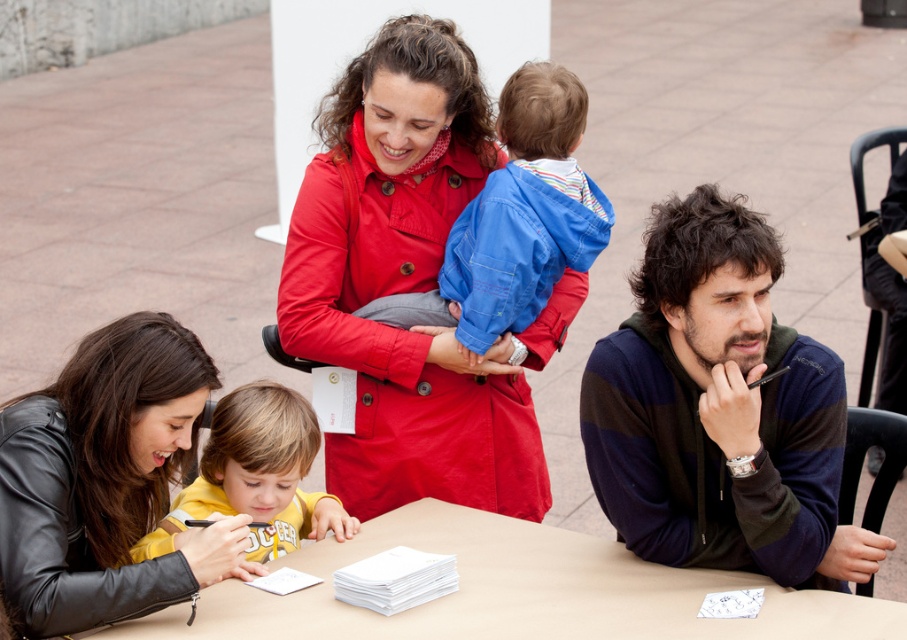
You are a photographer at the event and need to place a small camera on the smooth beige table at lower center. Considering the height difference between the table and the yellow jersey at lower left, will the camera be visible to someone standing next to the yellow jersey?

The smooth beige table at lower center has a lesser height compared to yellow jersey at lower left, so the camera placed on the smooth beige table at lower center may not be fully visible to someone standing next to the yellow jersey at lower left due to the table being shorter.

You are standing in front of the light brown table at the public event. There are two points marked on the table surface. One is at coordinate point (395, 440) and the other at point (173, 413). Which point is closer to you?

Point (395, 440) is closer to you because it is further to the viewer than point (173, 413).

You are standing at the origin point of the image coordinate system. The black leather jacket at lower left is located at point (103, 480). If you want to walk directly to the black leather jacket at lower left, in which direction should you move?

Since the black leather jacket at lower left is located at point (103, 480), you should move towards the lower left direction to reach it.